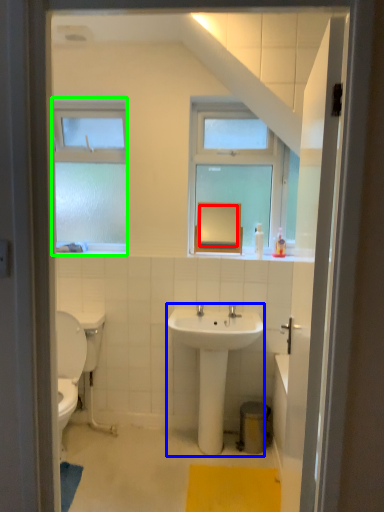
Question: Which object is positioned farthest from mirror (highlighted by a red box)? Select from sink (highlighted by a blue box) and window (highlighted by a green box).

Choices:
 (A) sink
 (B) window

Answer: (B)